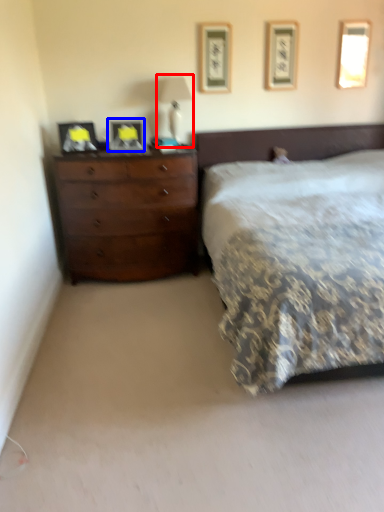
Question: Among these objects, which one is farthest to the camera, bedside lamp (highlighted by a red box) or picture frame (highlighted by a blue box)?

Choices:
 (A) bedside lamp
 (B) picture frame

Answer: (A)